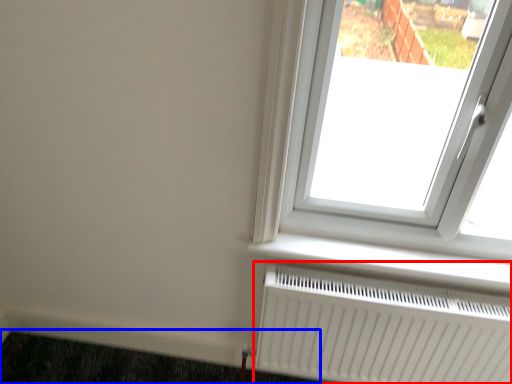
Question: Among these objects, which one is farthest to the camera, radiator (highlighted by a red box) or doormat (highlighted by a blue box)?

Choices:
 (A) radiator
 (B) doormat

Answer: (B)